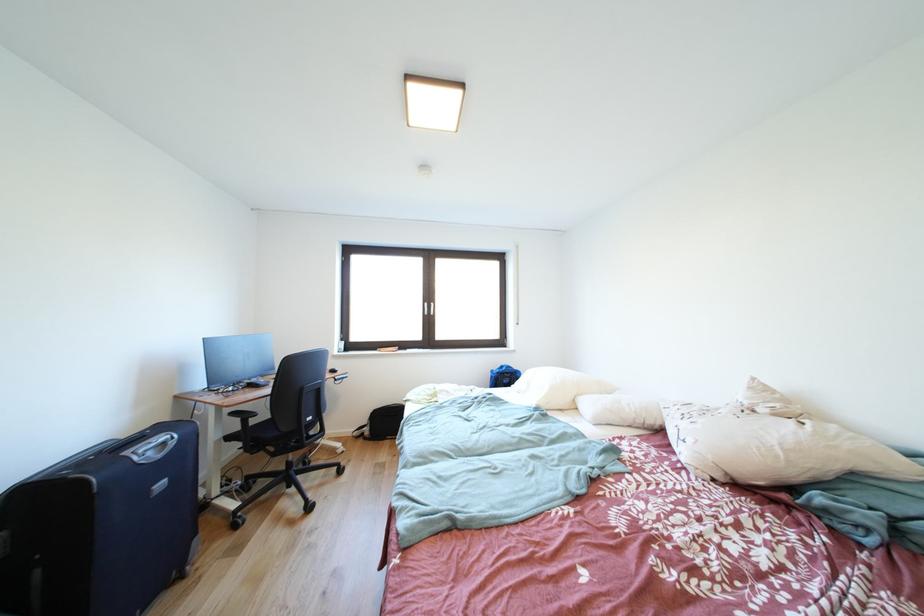
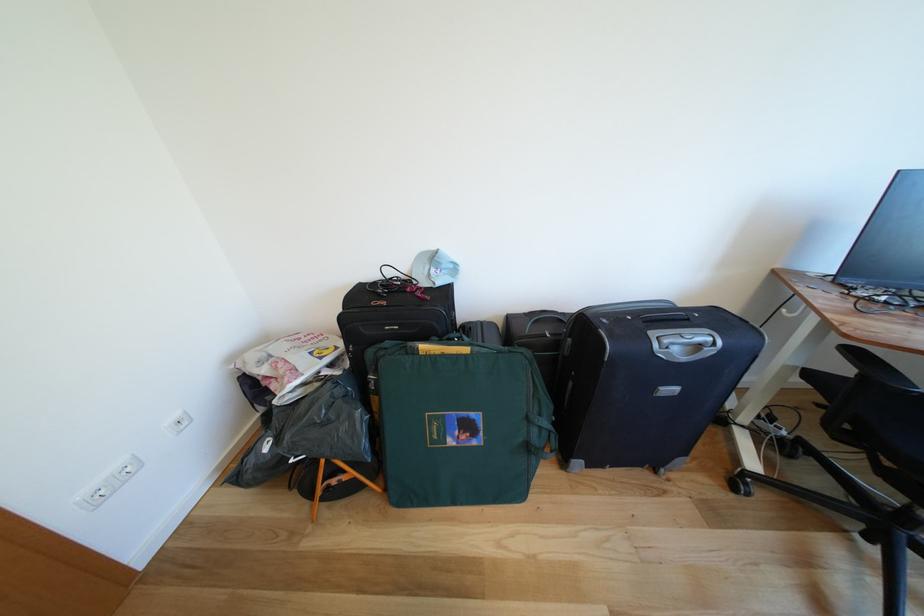
Locate, in the second image, the point that corresponds to the point at 173,448 in the first image.

(707, 351)